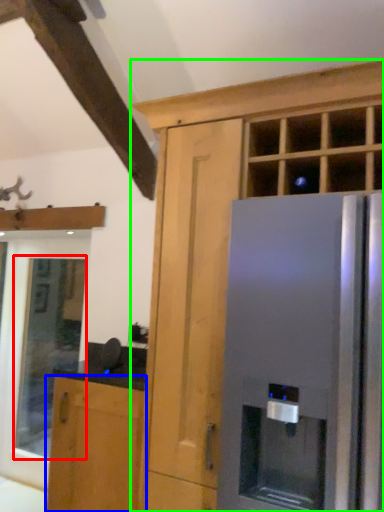
Question: Considering the real-world distances, which object is closest to window (highlighted by a red box)? cabinetry (highlighted by a blue box) or cabinetry (highlighted by a green box).

Choices:
 (A) cabinetry
 (B) cabinetry

Answer: (A)